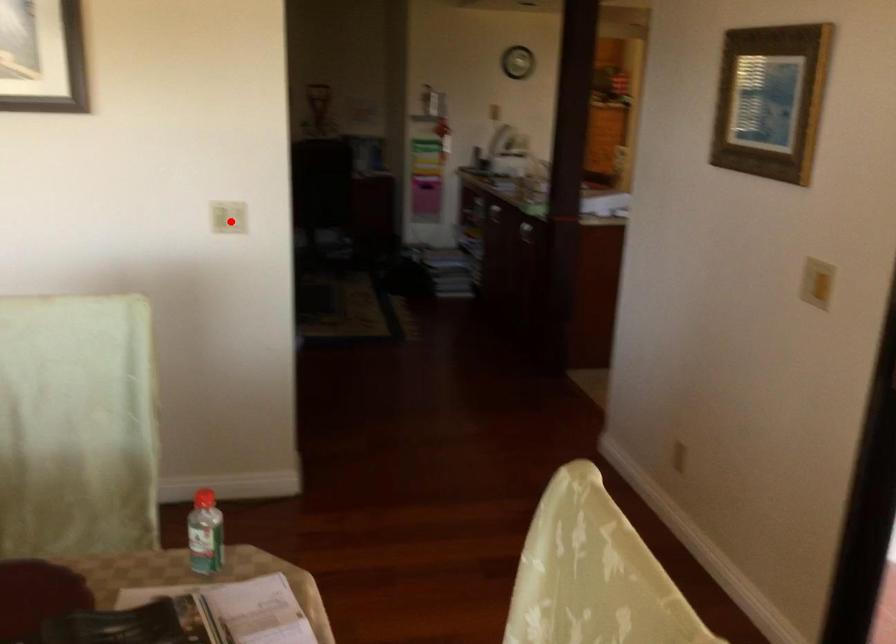
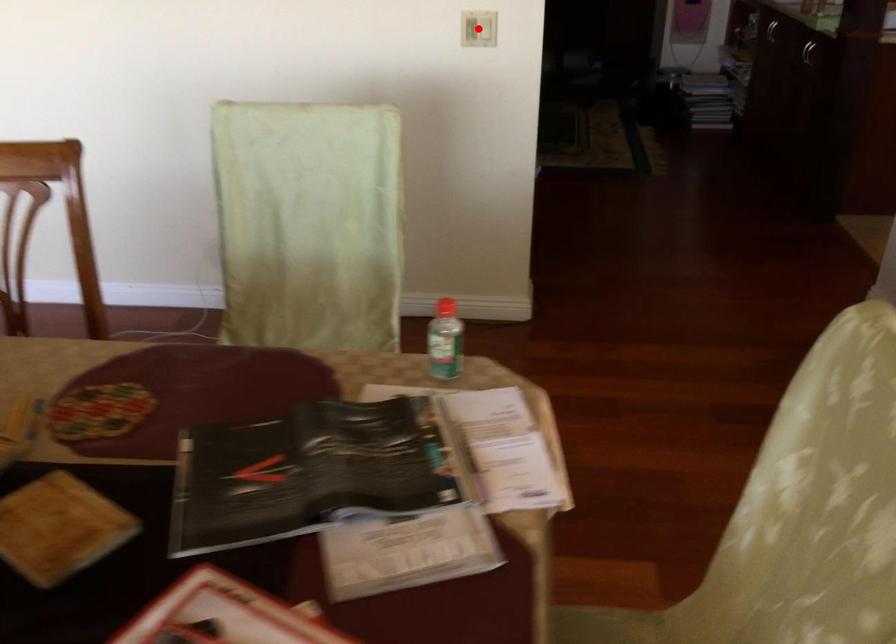
I am providing you with two images of the same scene from different viewpoints. A red point is marked on the first image and another point is marked on the second image. Does the point marked in image1 correspond to the same location as the one in image2?

Yes